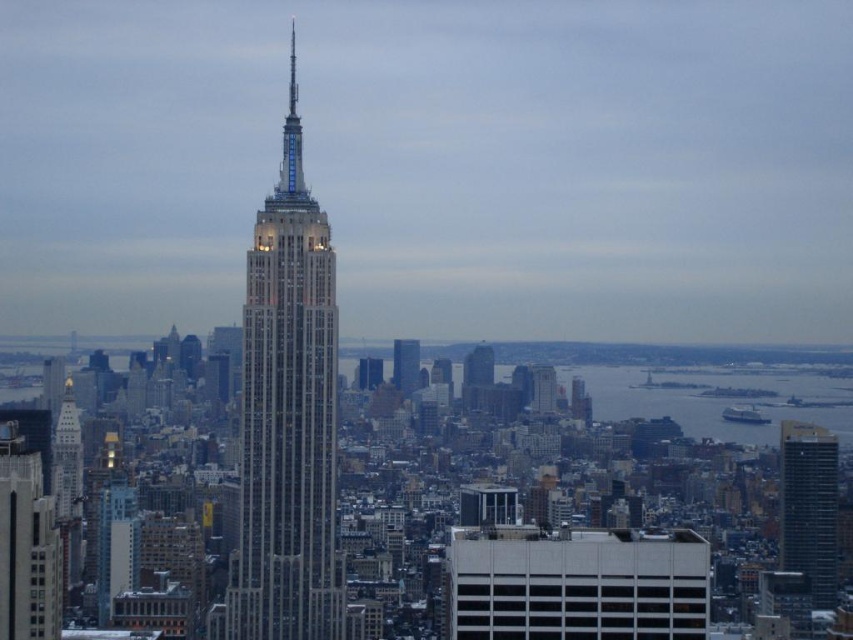
Can you confirm if white marble skyscraper at center is shorter than glassy reflective skyscraper at center?

No, white marble skyscraper at center is not shorter than glassy reflective skyscraper at center.

Is point (331, 257) positioned behind point (402, 356)?

Yes, it is behind point (402, 356).

Between point (288, 588) and point (404, 369), which one is positioned in front?

Positioned in front is point (404, 369).

Locate an element on the screen. white marble skyscraper at center is located at coordinates (287, 417).

You are a GUI agent. You are given a task and a screenshot of the screen. Output one action in this format:
    pyautogui.click(x=<x>, y=<y>)
    Task: Click on the white marble skyscraper at center
    Image resolution: width=853 pixels, height=640 pixels.
    Given the screenshot: What is the action you would take?
    pyautogui.click(x=287, y=417)

Which is more to the right, white marble skyscraper at center or glassy steel skyscraper at center?

Positioned to the right is glassy steel skyscraper at center.

At what (x,y) coordinates should I click in order to perform the action: click on white marble skyscraper at center. Please return your answer as a coordinate pair (x, y). Looking at the image, I should click on (287, 417).

Does dark glass skyscraper at right appear over glassy steel skyscraper at center?

No, dark glass skyscraper at right is not above glassy steel skyscraper at center.

Is dark glass skyscraper at right positioned in front of glassy steel skyscraper at center?

No, it is not.

Measure the distance between dark glass skyscraper at right and camera.

dark glass skyscraper at right is 2189.29 feet from camera.

Locate an element on the screen. This screenshot has height=640, width=853. dark glass skyscraper at right is located at coordinates (809, 508).